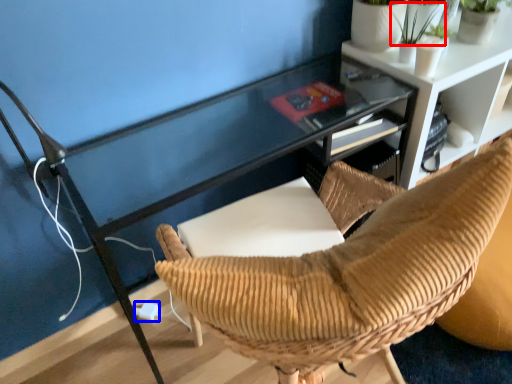
Question: Which object appears farthest to the camera in this image, plant (highlighted by a red box) or plug (highlighted by a blue box)?

Choices:
 (A) plant
 (B) plug

Answer: (B)